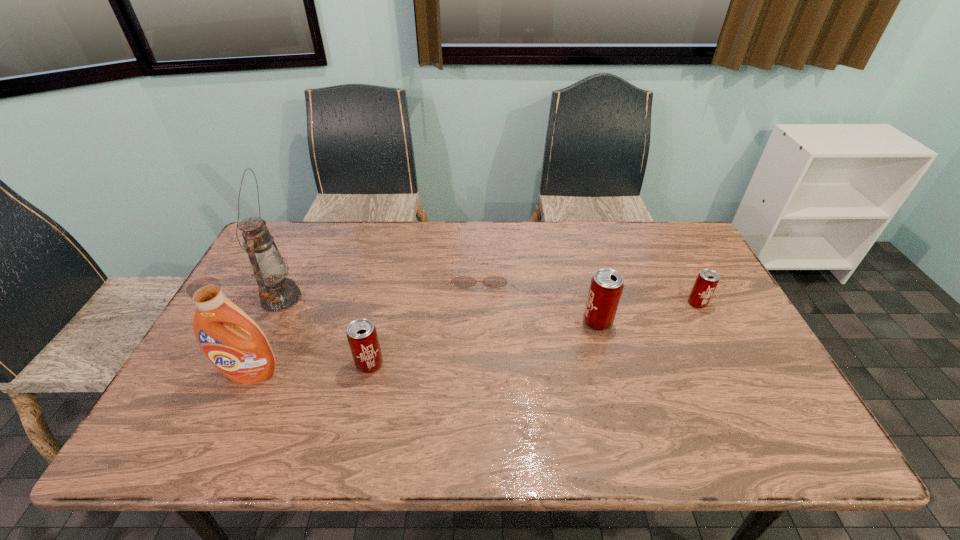
I want to click on free spot located 0.170m on the left of the second tallest beer can, so click(x=290, y=364).

Where is `free region located on the right of the second beer can from left to right`? The image size is (960, 540). free region located on the right of the second beer can from left to right is located at coordinates (691, 321).

Find the location of a particular element. free spot located 0.380m on the left of the rightmost object is located at coordinates (558, 303).

Where is `vacant space located on the front-facing side of the detergent`? vacant space located on the front-facing side of the detergent is located at coordinates point(234,409).

Image resolution: width=960 pixels, height=540 pixels. What are the coordinates of `vacant position located 0.200m on the back of the oil lamp` in the screenshot? It's located at (308, 241).

Where is `free spot located 0.280m on the face of the third object from right to left`? The image size is (960, 540). free spot located 0.280m on the face of the third object from right to left is located at coordinates (479, 363).

I want to click on object that is at the far edge, so click(x=461, y=281).

Locate an element on the screen. object located at the near edge is located at coordinates (233, 342).

Where is `detergent at the left edge`? detergent at the left edge is located at coordinates (233, 342).

At what (x,y) coordinates should I click in order to perform the action: click on oil lamp that is positioned at the left edge. Please return your answer as a coordinate pair (x, y). The image size is (960, 540). Looking at the image, I should click on click(x=277, y=293).